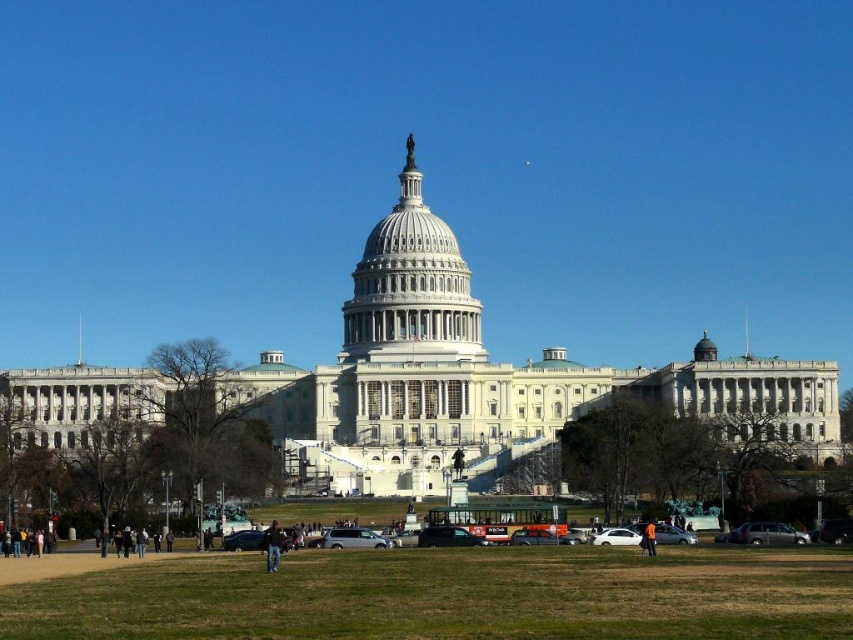
Question: Estimate the real-world distances between objects in this image. Which object is closer to the orange fabric person at lower right?

Choices:
 (A) black fabric jacket at lower center
 (B) white marble dome at center

Answer: (A)

Question: Observing the image, what is the correct spatial positioning of black fabric jacket at lower center in reference to orange fabric person at lower right?

Choices:
 (A) right
 (B) left

Answer: (B)

Question: Does white marble dome at center appear on the right side of orange fabric person at lower right?

Choices:
 (A) no
 (B) yes

Answer: (A)

Question: Which object is farther from the camera taking this photo?

Choices:
 (A) black fabric jacket at lower center
 (B) orange fabric person at lower right

Answer: (B)

Question: Which object is closer to the camera taking this photo?

Choices:
 (A) black fabric jacket at lower center
 (B) orange fabric person at lower right

Answer: (A)

Question: Can you confirm if white marble dome at center is positioned above black fabric jacket at lower center?

Choices:
 (A) yes
 (B) no

Answer: (A)